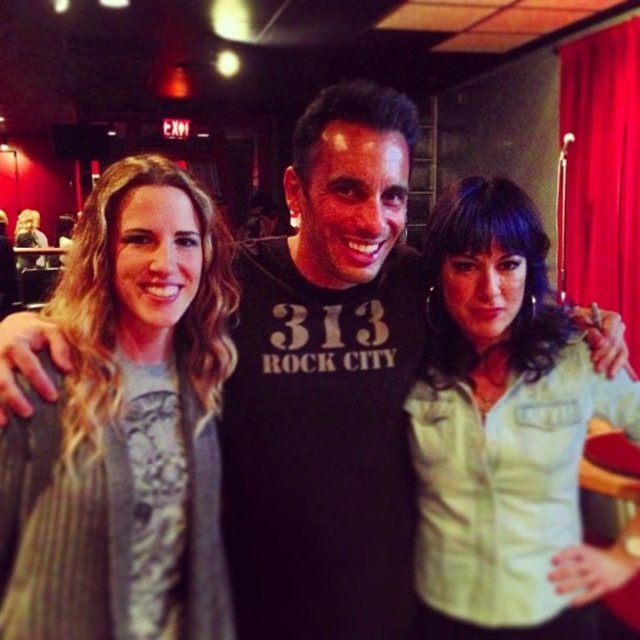
Question: Which point is farther to the camera?

Choices:
 (A) gray textured sweater at left
 (B) light green denim jacket at center
 (C) red velvet curtain at upper right

Answer: (C)

Question: Estimate the real-world distances between objects in this image. Which object is farther from the gray textured sweater at left?

Choices:
 (A) blonde hair at center
 (B) red velvet curtain at upper right
 (C) light green denim jacket at center

Answer: (A)

Question: Which object is closer to the camera taking this photo?

Choices:
 (A) red velvet curtain at upper right
 (B) gray textured sweater at left
 (C) blonde hair at center
 (D) light green denim jacket at center

Answer: (B)

Question: Is red velvet curtain at upper right positioned at the back of blonde hair at center?

Choices:
 (A) no
 (B) yes

Answer: (A)

Question: Is light green denim jacket at center bigger than red velvet curtain at upper right?

Choices:
 (A) no
 (B) yes

Answer: (A)

Question: Is light green denim jacket at center to the left of red velvet curtain at upper right from the viewer's perspective?

Choices:
 (A) no
 (B) yes

Answer: (B)